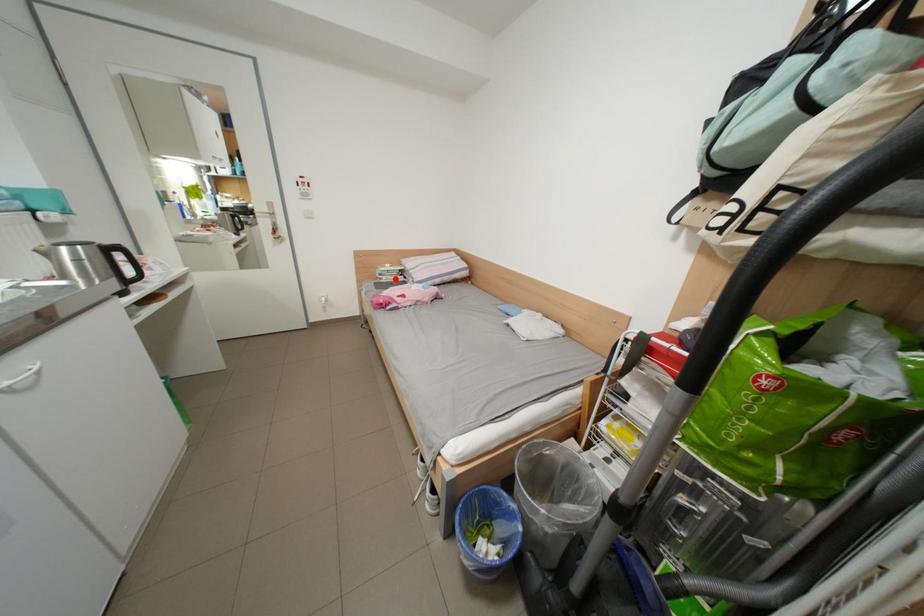
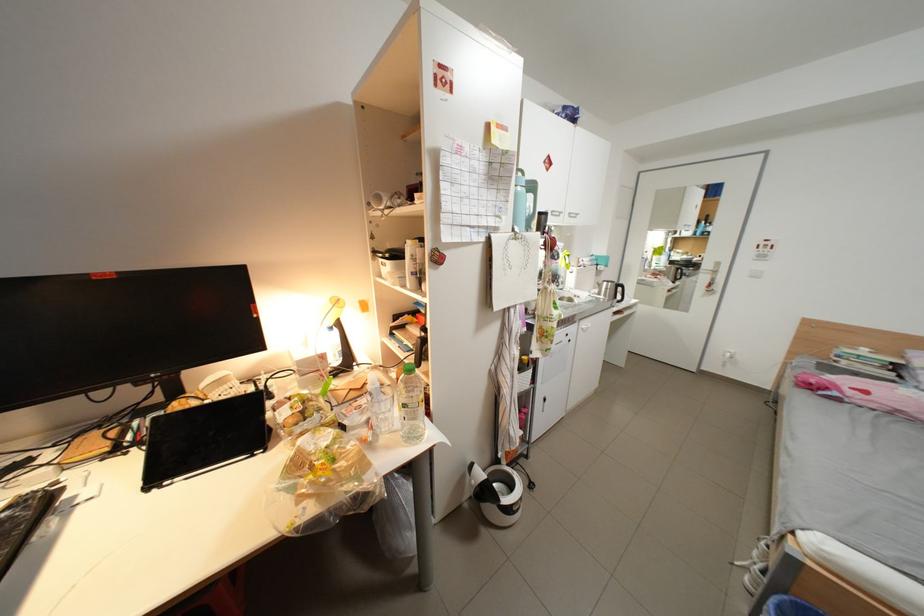
Find the pixel in the second image that matches the highlighted location in the first image.

(856, 363)